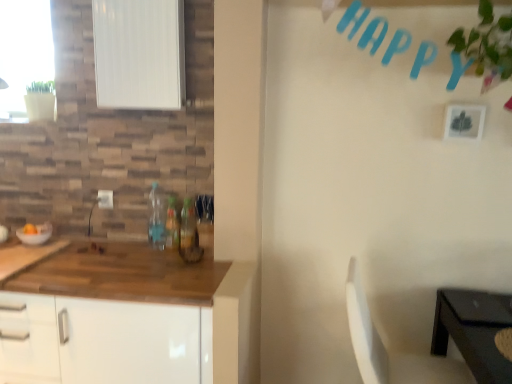
The image size is (512, 384). I want to click on vacant space that is to the left of translucent plastic bottle at center, which is counted as the 2th bottle, starting from the right, so click(x=137, y=245).